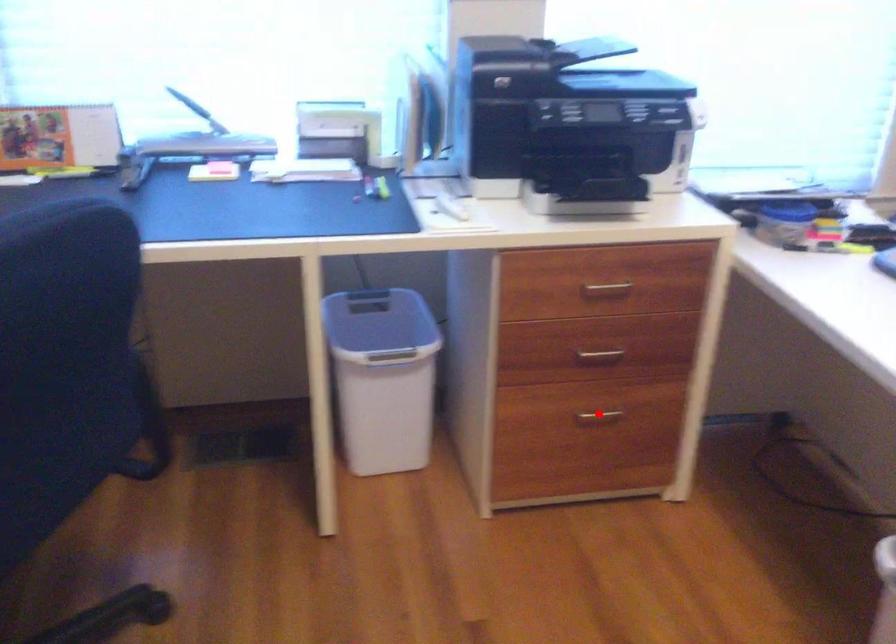
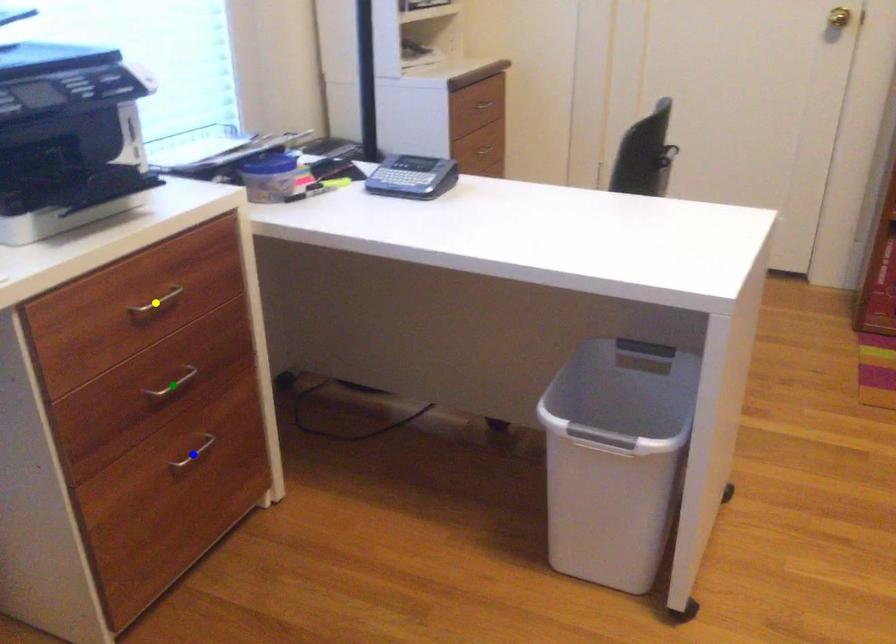
Question: I am providing you with two images of the same scene from different viewpoints. A red point is marked on the first image. You are given multiple points on the second image. Which point in image 2 represents the same 3d spot as the red point in image 1?

Choices:
 (A) green point
 (B) yellow point
 (C) blue point

Answer: (C)